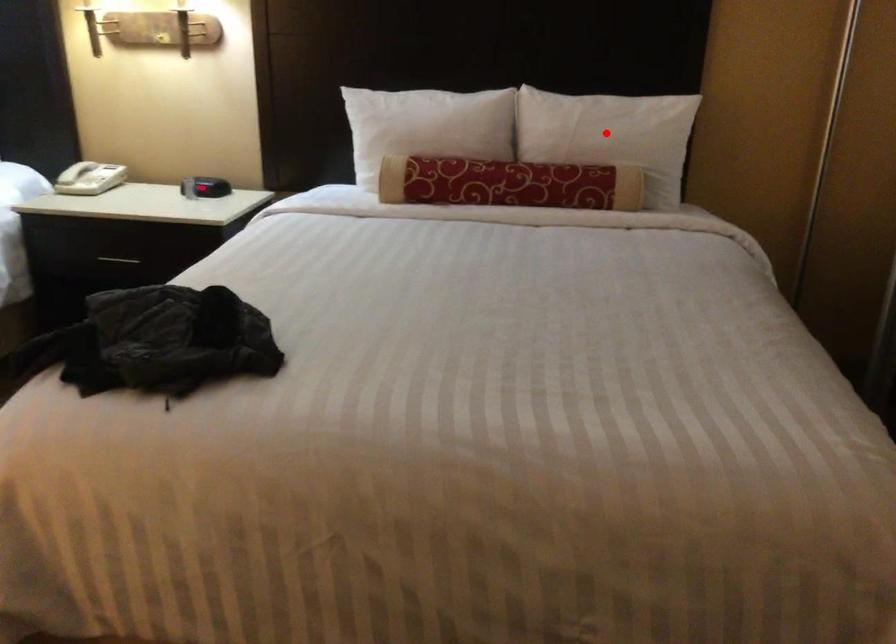
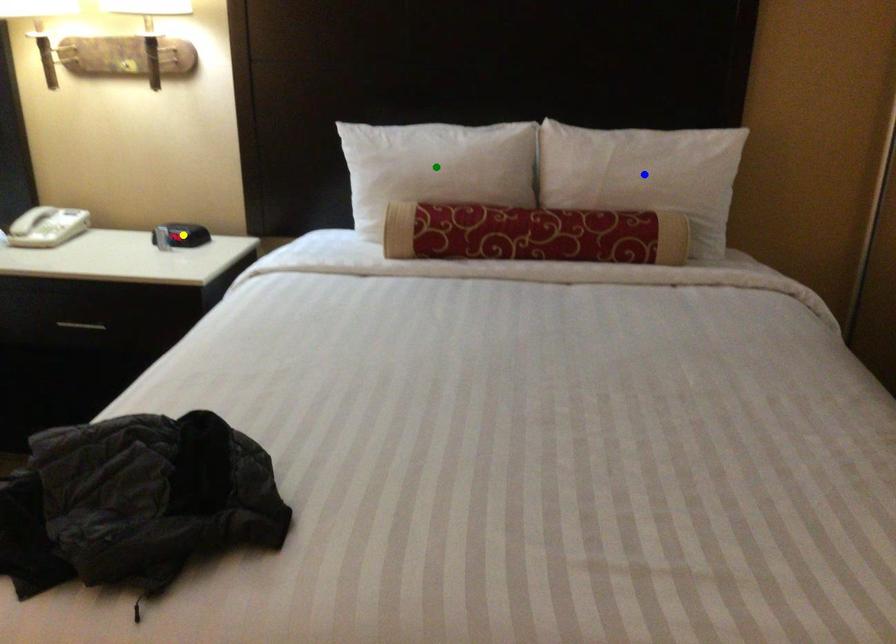
Question: I am providing you with two images of the same scene from different viewpoints. A red point is marked on the first image. You are given multiple points on the second image. Which point in image 2 is actually the same real-world point as the red point in image 1?

Choices:
 (A) yellow point
 (B) green point
 (C) blue point

Answer: (C)